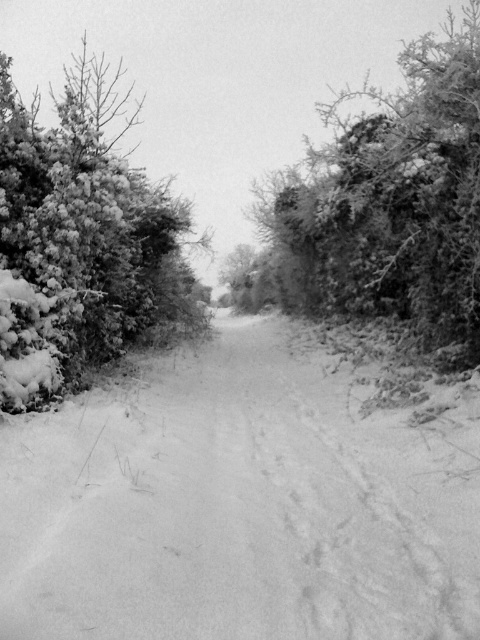
Question: Can you confirm if white powdery snow at center is bigger than snow-covered bush at left?

Choices:
 (A) no
 (B) yes

Answer: (A)

Question: Is snow-covered bush at left bigger than snow-covered bush at right?

Choices:
 (A) yes
 (B) no

Answer: (B)

Question: Is white powdery snow at center further to camera compared to snow-covered bush at right?

Choices:
 (A) yes
 (B) no

Answer: (B)

Question: Which object is farther from the camera taking this photo?

Choices:
 (A) snow-covered bush at right
 (B) snow-covered bush at left
 (C) white powdery snow at center

Answer: (A)

Question: Which of the following is the farthest from the observer?

Choices:
 (A) snow-covered bush at right
 (B) white powdery snow at center
 (C) snow-covered bush at left

Answer: (A)

Question: Which of these objects is positioned farthest from the snow-covered bush at right?

Choices:
 (A) snow-covered bush at left
 (B) white powdery snow at center

Answer: (B)